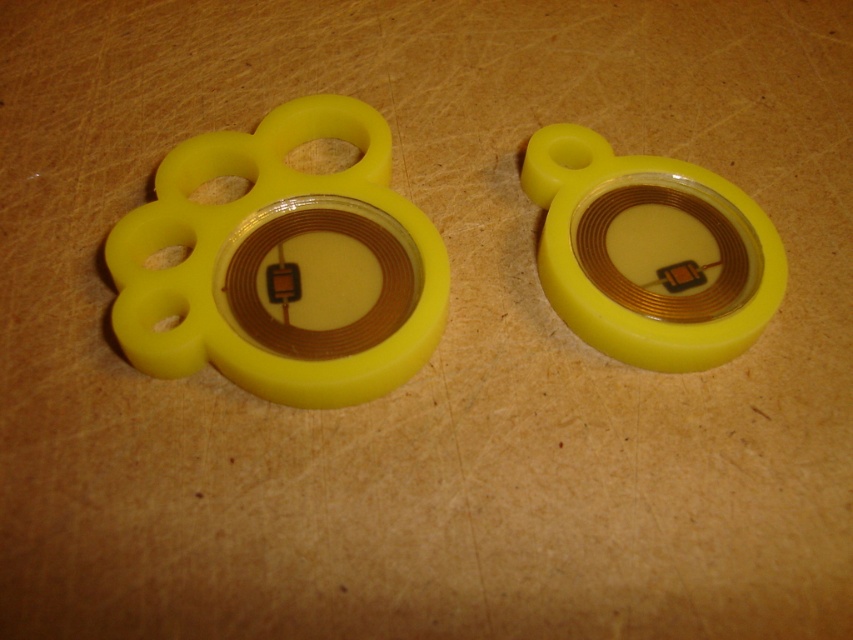
Question: Can you confirm if matte yellow paw at center is smaller than yellow matte/soft toy at right?

Choices:
 (A) no
 (B) yes

Answer: (A)

Question: Which point appears farthest from the camera in this image?

Choices:
 (A) (689, 340)
 (B) (322, 205)

Answer: (B)

Question: Is matte yellow paw at center further to camera compared to yellow matte/soft toy at right?

Choices:
 (A) yes
 (B) no

Answer: (B)

Question: Can you confirm if matte yellow paw at center is positioned above yellow matte/soft toy at right?

Choices:
 (A) yes
 (B) no

Answer: (B)